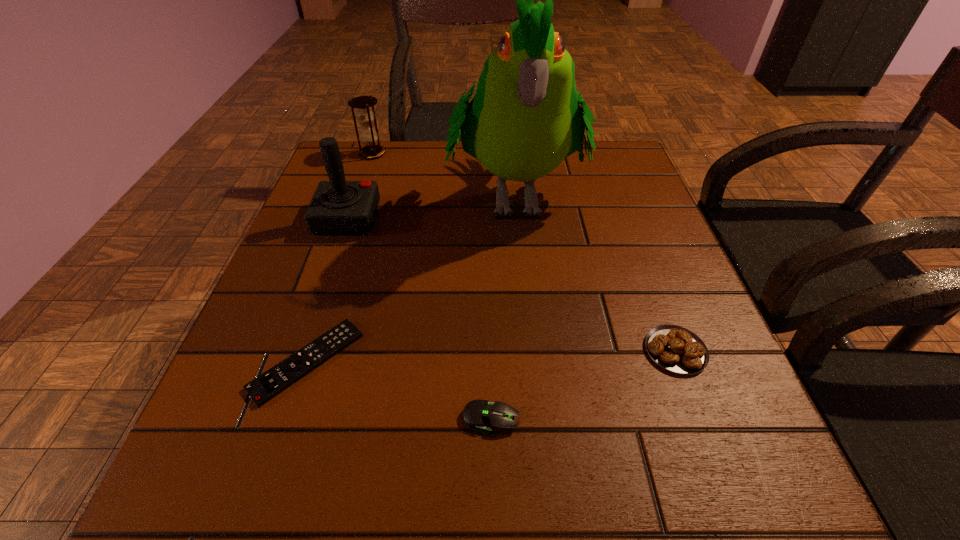
Identify the location of parakeet. This screenshot has width=960, height=540. (524, 119).

Locate an element on the screen. This screenshot has height=540, width=960. joystick is located at coordinates (338, 207).

This screenshot has width=960, height=540. What are the coordinates of `the third tallest object` in the screenshot? It's located at (369, 137).

Where is `pastry`? The width and height of the screenshot is (960, 540). pastry is located at coordinates (676, 349).

Image resolution: width=960 pixels, height=540 pixels. I want to click on the rightmost object, so click(x=676, y=349).

Identify the location of the fifth tallest object. This screenshot has width=960, height=540. (482, 416).

The width and height of the screenshot is (960, 540). Identify the location of remote control. (269, 384).

Image resolution: width=960 pixels, height=540 pixels. What are the coordinates of `free space located on the beak of the parakeet` in the screenshot? It's located at (529, 355).

Identify the location of vacant space located on the base of the joystick. (421, 219).

Find the location of a particular element. vacant position located on the right of the fourth shortest object is located at coordinates (474, 153).